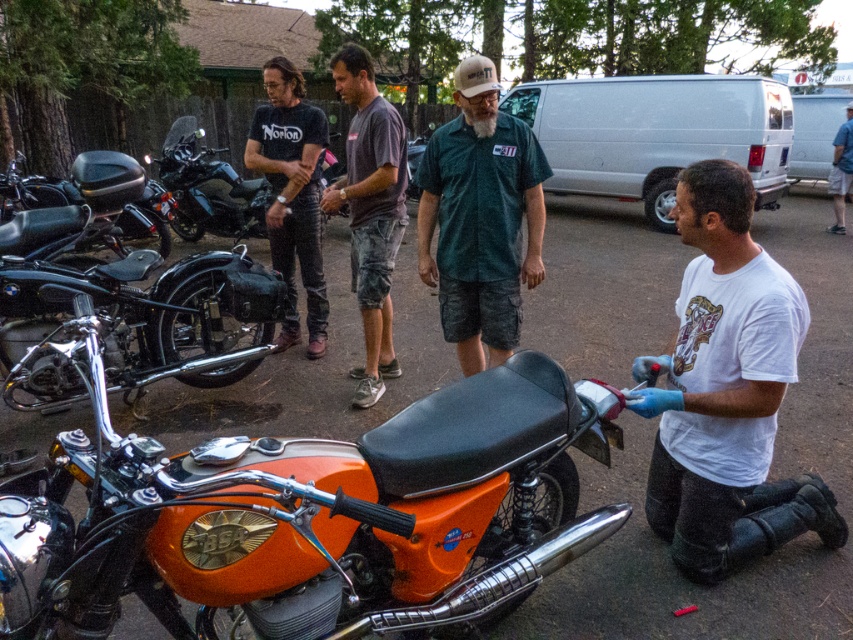
You are standing at the edge of the parking lot and see the vintage motorcycle and the green camo shorts at center. According to their positions, which object is closer to you?

The green camo shorts at center is located at point 0.341 on the x and 0.564 on the y, so the green camo shorts at center is closer to you than the vintage motorcycle.

Based on the photo, you are standing at the point labeled as point (309, 513) in the image. What object are you currently standing on?

You are standing on the orange matte motorcycle at center, as the point (309, 513) corresponds to that object.